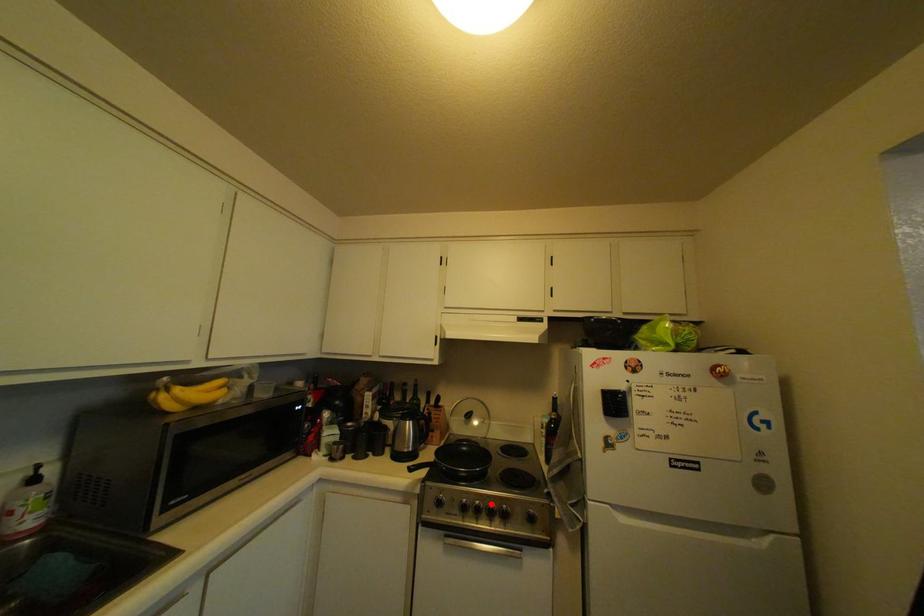
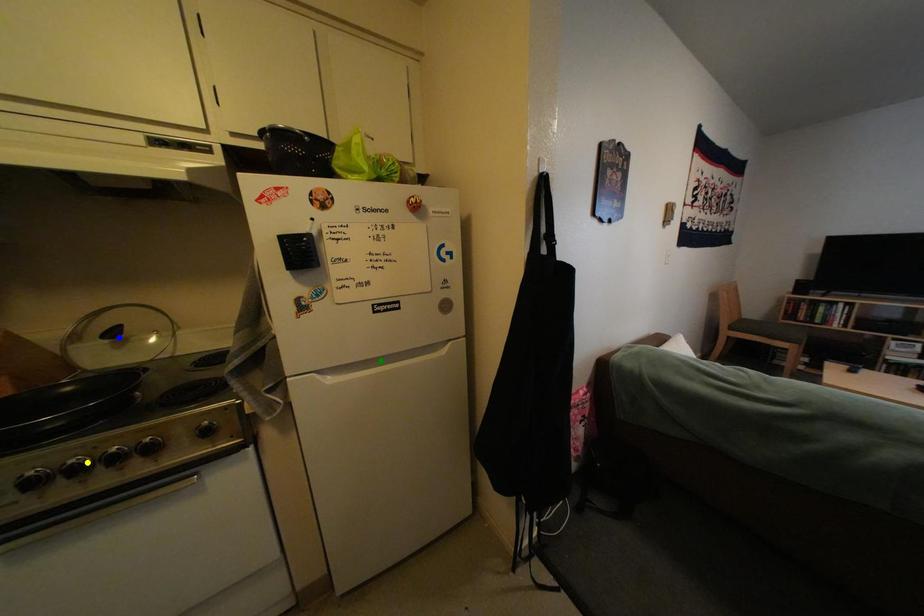
Question: I am providing you with two images of the same scene from different viewpoints. A red point is marked on the first image. You are given multiple points on the second image. In image 2, which mark is for the same physical point as the one in image 1?

Choices:
 (A) blue point
 (B) green point
 (C) yellow point

Answer: (C)